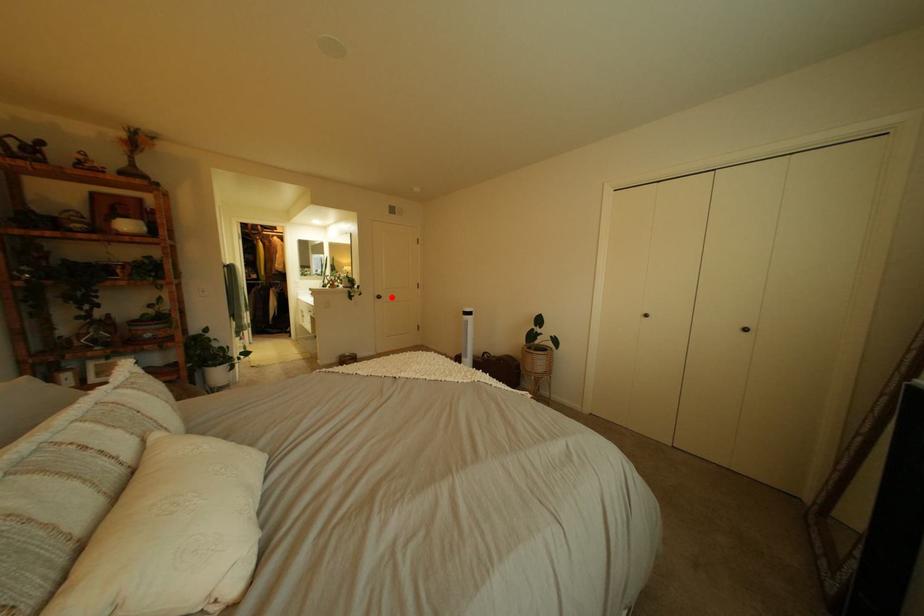
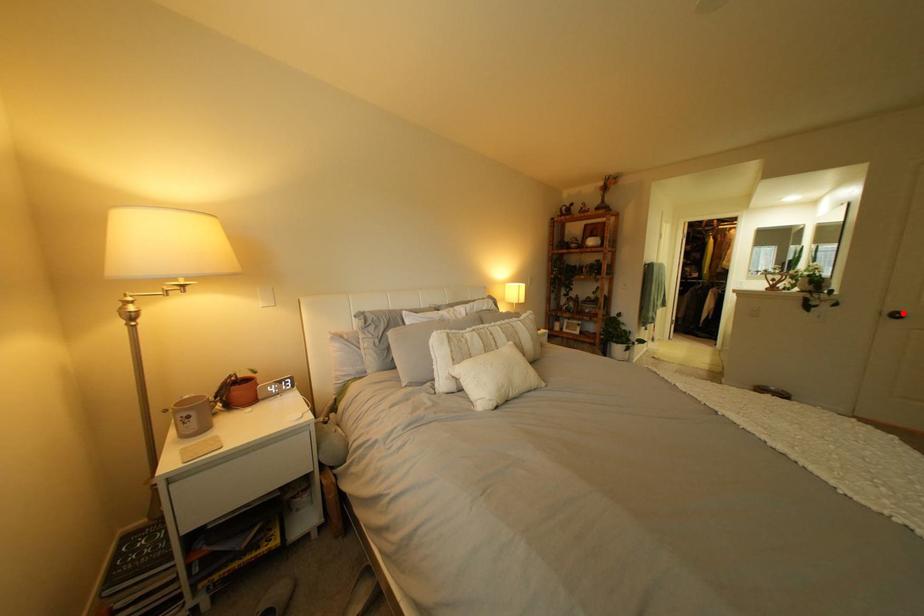
I am providing you with two images of the same scene from different viewpoints. A red point is marked on the first image and another point is marked on the second image. Does the point marked in image1 correspond to the same location as the one in image2?

Yes